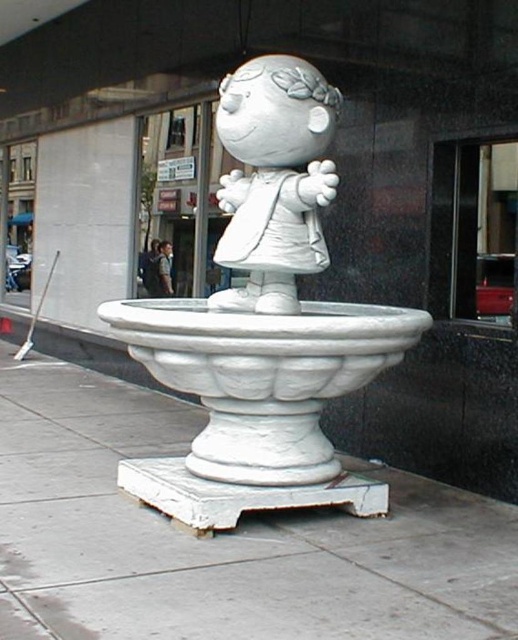
Does point (356, 616) come farther from viewer compared to point (249, 282)?

That is False.

Is white marble base at center further to camera compared to white matte figurine at center?

No.

Does point (267, 634) come behind point (223, 188)?

No.

Find the location of `white marble base at center`. white marble base at center is located at coordinates (221, 538).

Describe the element at coordinates (221, 538) in the screenshot. I see `white marble base at center` at that location.

Who is more distant from viewer, (x=76, y=456) or (x=278, y=134)?

The point (x=76, y=456) is behind.

Identify the location of white marble base at center. The height and width of the screenshot is (640, 518). (221, 538).

Does white marble fountain at center appear on the left side of white matte figurine at center?

Incorrect, white marble fountain at center is not on the left side of white matte figurine at center.

Who is shorter, white marble fountain at center or white matte figurine at center?

With less height is white marble fountain at center.

Is point (287, 256) farther from viewer compared to point (268, 80)?

Yes, point (287, 256) is behind point (268, 80).

At what (x,y) coordinates should I click in order to perform the action: click on white marble fountain at center. Please return your answer as a coordinate pair (x, y). The height and width of the screenshot is (640, 518). Looking at the image, I should click on (264, 323).